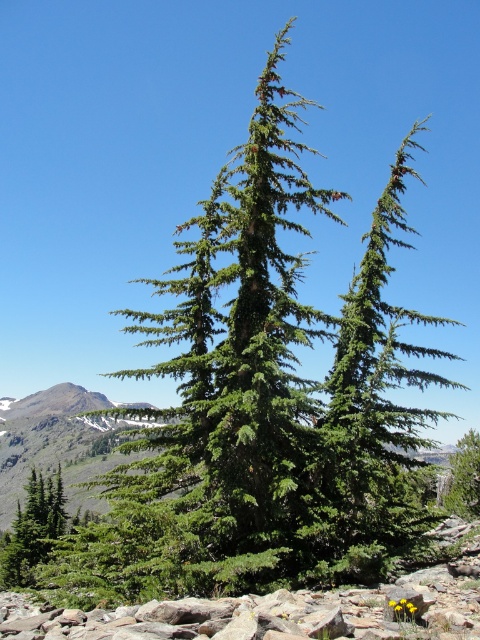
Can you confirm if green matte evergreen tree at lower left is smaller than green needle-like at center?

Incorrect, green matte evergreen tree at lower left is not smaller in size than green needle-like at center.

Between green matte evergreen tree at lower left and green needle-like at center, which one has less height?

green needle-like at center

What do you see at coordinates (33, 529) in the screenshot?
I see `green matte evergreen tree at lower left` at bounding box center [33, 529].

You are a GUI agent. You are given a task and a screenshot of the screen. Output one action in this format:
    pyautogui.click(x=<x>, y=<y>)
    Task: Click on the green matte evergreen tree at lower left
    
    Given the screenshot: What is the action you would take?
    pyautogui.click(x=33, y=529)

Is green coniferous tree at center thinner than green matte evergreen tree at lower left?

Incorrect, green coniferous tree at center's width is not less than green matte evergreen tree at lower left's.

Which is in front, point (8, 476) or point (36, 476)?

Point (36, 476) is in front.

Where is `green coniferous tree at center`? The image size is (480, 640). green coniferous tree at center is located at coordinates (58, 444).

Between green coniferous tree at center and green needle-like at center, which one appears on the right side from the viewer's perspective?

Positioned to the right is green needle-like at center.

Between green coniferous tree at center and green needle-like at center, which one is positioned lower?

green coniferous tree at center

You are a GUI agent. You are given a task and a screenshot of the screen. Output one action in this format:
    pyautogui.click(x=<x>, y=<y>)
    Task: Click on the green coniferous tree at center
    This screenshot has width=480, height=640.
    Given the screenshot: What is the action you would take?
    pyautogui.click(x=58, y=444)